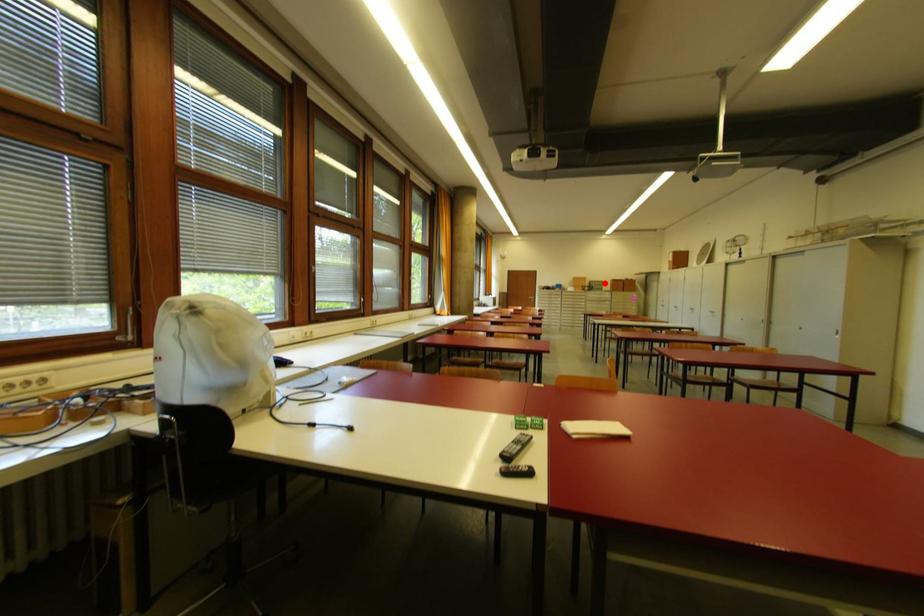
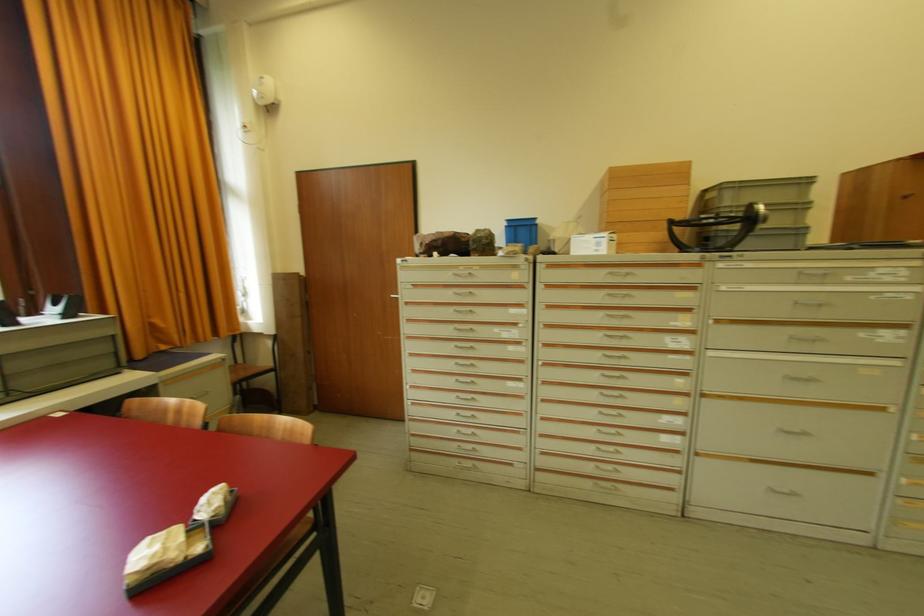
Question: I am providing you with two images of the same scene from different viewpoints. A red point is shown in image1. For the corresponding object point in image2, is it positioned nearer or farther from the camera?

Choices:
 (A) Nearer
 (B) Farther

Answer: (B)